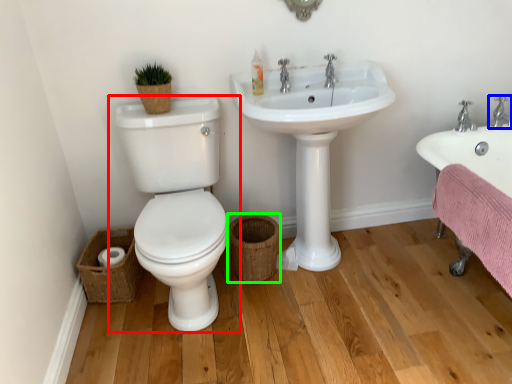
Question: Based on their relative distances, which object is farther from toilet (highlighted by a red box)? Choose from tap (highlighted by a blue box) and basket (highlighted by a green box).

Choices:
 (A) tap
 (B) basket

Answer: (A)